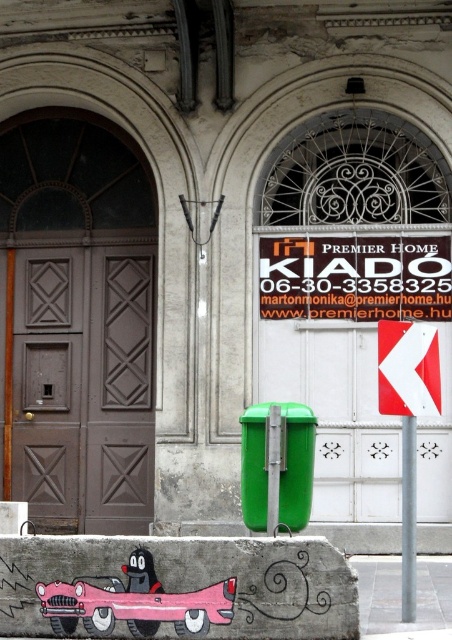
You are standing in front of the old building facade. There are two points marked on the image. The first point is located at coordinate point (428, 288) and the second at point (417, 326). If you were to walk towards the building, which point would you encounter first?

Point (428, 288) is closer to the viewer than point (417, 326), so you would encounter point (428, 288) first as you walk towards the building.

You are a child playing with a pink matte toy car at lower left. You want to move it to the point marked at coordinates (135, 602). Is the point where you want to move the car located on the car itself?

The point at coordinates (135, 602) is on the pink matte toy car at lower left, so yes, the point is already on the car.